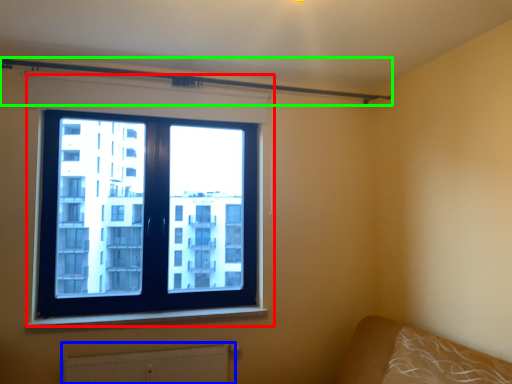
Question: Considering the real-world distances, which object is closest to window (highlighted by a red box)? radiator (highlighted by a blue box) or beam (highlighted by a green box).

Choices:
 (A) radiator
 (B) beam

Answer: (B)